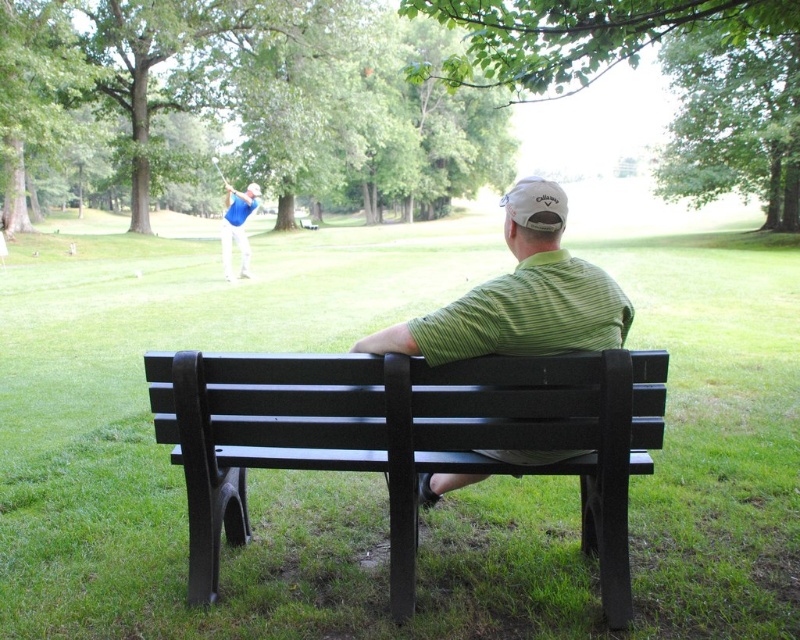
Which of these two, green grass at center or green striped shirt at center, stands taller?

Standing taller between the two is green grass at center.

Can you confirm if green grass at center is thinner than green striped shirt at center?

Incorrect, green grass at center's width is not less than green striped shirt at center's.

Is point (284, 481) positioned behind point (625, 326)?

Yes, point (284, 481) is behind point (625, 326).

Image resolution: width=800 pixels, height=640 pixels. I want to click on green grass at center, so click(x=254, y=470).

Can you confirm if green striped shirt at center is wider than blue fabric shirt at upper center?

No, green striped shirt at center is not wider than blue fabric shirt at upper center.

Does green striped shirt at center appear over blue fabric shirt at upper center?

No.

Between point (540, 452) and point (244, 253), which one is positioned behind?

Point (244, 253)

I want to click on green striped shirt at center, so click(520, 296).

Which is more to the right, green grass at center or blue fabric shirt at upper center?

From the viewer's perspective, green grass at center appears more on the right side.

Is green grass at center below blue fabric shirt at upper center?

Yes.

Describe the element at coordinates (254, 470) in the screenshot. I see `green grass at center` at that location.

Locate an element on the screen. green grass at center is located at coordinates (254, 470).